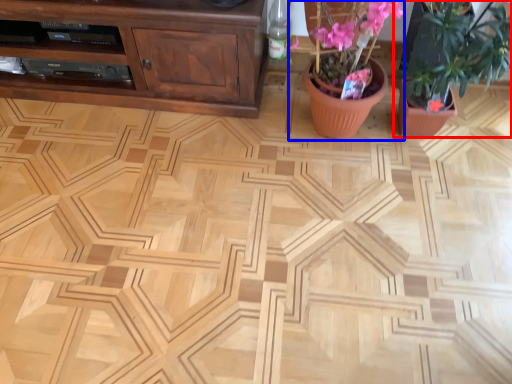
Question: Which point is closer to the camera, houseplant (highlighted by a red box) or floral arrangement (highlighted by a blue box)?

Choices:
 (A) houseplant
 (B) floral arrangement

Answer: (A)